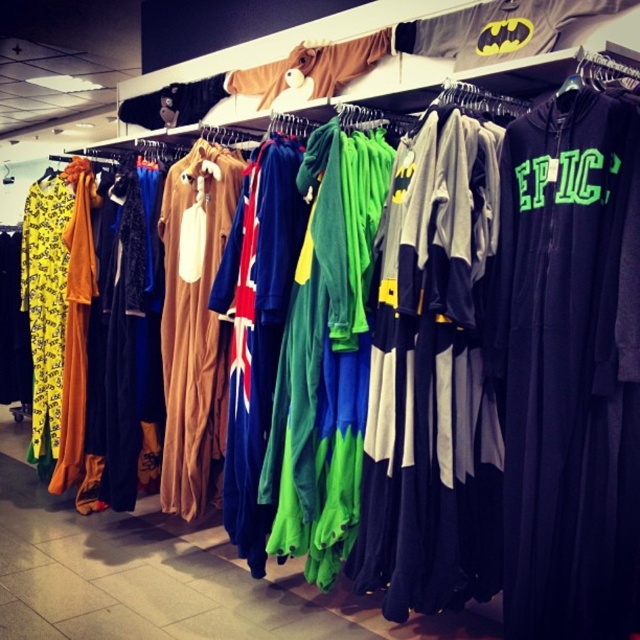
Which of these two, gray cotton t-shirt at upper center or brown plush onesie at upper center, stands taller?

gray cotton t-shirt at upper center is taller.

Does gray cotton t-shirt at upper center appear on the left side of brown plush onesie at upper center?

In fact, gray cotton t-shirt at upper center is to the right of brown plush onesie at upper center.

Is point (524, 40) behind point (260, 108)?

No, it is not.

I want to click on gray cotton t-shirt at upper center, so point(499,29).